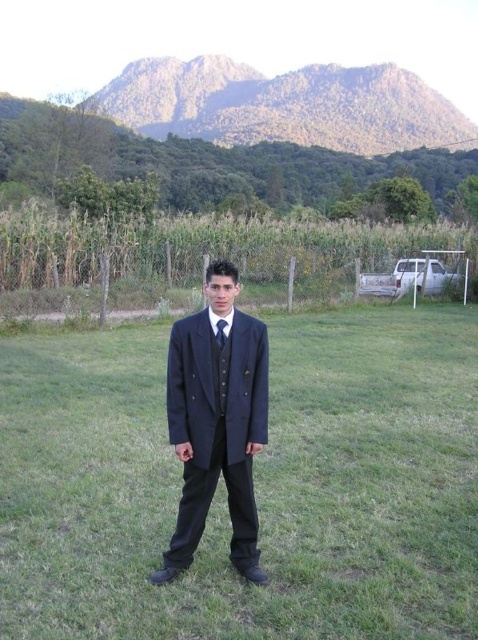
Measure the distance from navy blue suit at center to dark blue silk tie at center.

The distance of navy blue suit at center from dark blue silk tie at center is 21.66 inches.

Which is above, navy blue suit at center or dark blue silk tie at center?

dark blue silk tie at center is above.

Locate an element on the screen. Image resolution: width=478 pixels, height=640 pixels. navy blue suit at center is located at coordinates (217, 420).

Is navy fabric suit at center wider than navy blue suit at center?

Correct, the width of navy fabric suit at center exceeds that of navy blue suit at center.

Locate an element on the screen. The width and height of the screenshot is (478, 640). navy fabric suit at center is located at coordinates click(x=254, y=484).

Does point (285, 516) come closer to viewer compared to point (229, 465)?

No.

Where is `navy fabric suit at center`? navy fabric suit at center is located at coordinates (254, 484).

Can you confirm if navy fabric suit at center is positioned below dark blue silk tie at center?

Correct, navy fabric suit at center is located below dark blue silk tie at center.

Measure the distance between navy fabric suit at center and camera.

navy fabric suit at center is 10.07 feet away from camera.

Where is `navy fabric suit at center`? navy fabric suit at center is located at coordinates (254, 484).